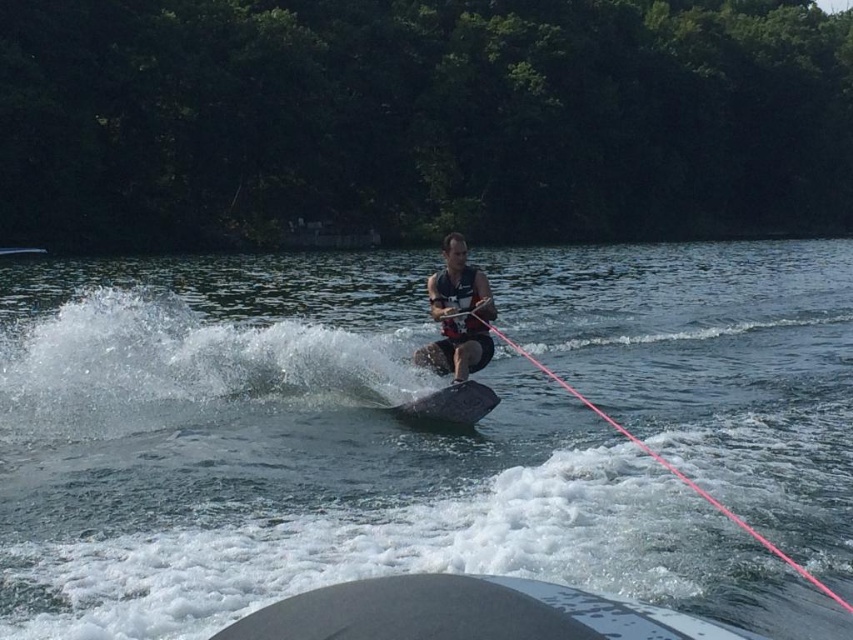
You are a water skier trying to locate the boat that is towing you. According to the coordinates provided, where should you look to find the smooth gray boat at center?

The smooth gray boat at center is located at coordinates point [466,612].